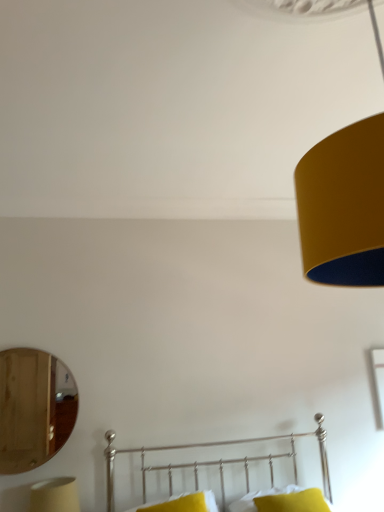
Question: From the image's perspective, is metallic silver bed at lower center located above or below wooden mirror at left?

Choices:
 (A) below
 (B) above

Answer: (A)

Question: Is point (258, 458) closer or farther from the camera than point (52, 366)?

Choices:
 (A) farther
 (B) closer

Answer: (A)

Question: Estimate the real-world distances between objects in this image. Which object is farther from the yellow fabric pillow at lower center, positioned as the second pillow in left-to-right order?

Choices:
 (A) matte yellow lampshade at lower left
 (B) metallic silver bed at lower center
 (C) yellow fabric pillow at lower center, which is the second pillow in right-to-left order
 (D) wooden mirror at left

Answer: (D)

Question: Estimate the real-world distances between objects in this image. Which object is farther from the matte yellow lampshade at lower left?

Choices:
 (A) yellow fabric pillow at lower center, which is the second pillow in right-to-left order
 (B) yellow fabric pillow at lower center, placed as the first pillow when sorted from right to left
 (C) metallic silver bed at lower center
 (D) wooden mirror at left

Answer: (B)